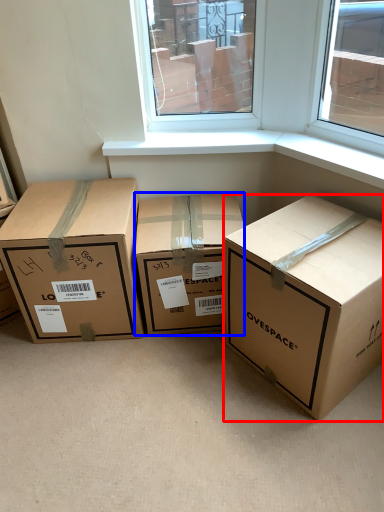
Question: Which object is closer to the camera taking this photo, box (highlighted by a red box) or box (highlighted by a blue box)?

Choices:
 (A) box
 (B) box

Answer: (A)